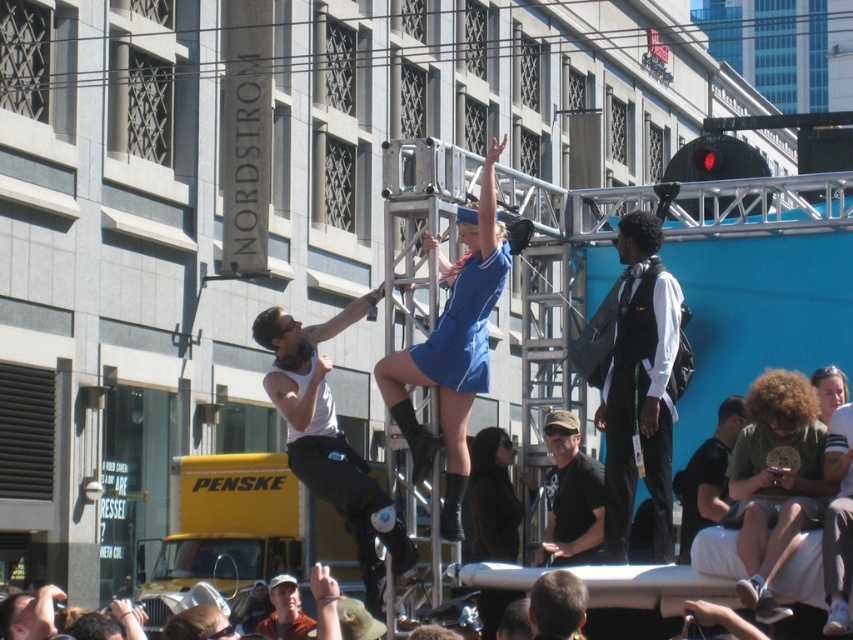
Question: Based on their relative distances, which object is nearer to the matte green shirt at lower right?

Choices:
 (A) blonde hair at center
 (B) black matte cap at center
 (C) orange t-shirt at lower center

Answer: (A)

Question: Is blue fabric dress at center thinner than black matte cap at center?

Choices:
 (A) yes
 (B) no

Answer: (B)

Question: Which point appears closest to the camera in this image?

Choices:
 (A) click(x=730, y=445)
 (B) click(x=628, y=417)
 (C) click(x=339, y=497)
 (D) click(x=426, y=356)

Answer: (C)

Question: Which of the following is the farthest from the observer?

Choices:
 (A) (512, 449)
 (B) (293, 586)

Answer: (B)

Question: Can you confirm if green fabric shirt at lower right is positioned to the right of blonde hair at center?

Choices:
 (A) no
 (B) yes

Answer: (B)

Question: Can you confirm if orange t-shirt at lower center is positioned above smooth blonde hair at upper center?

Choices:
 (A) yes
 (B) no

Answer: (B)